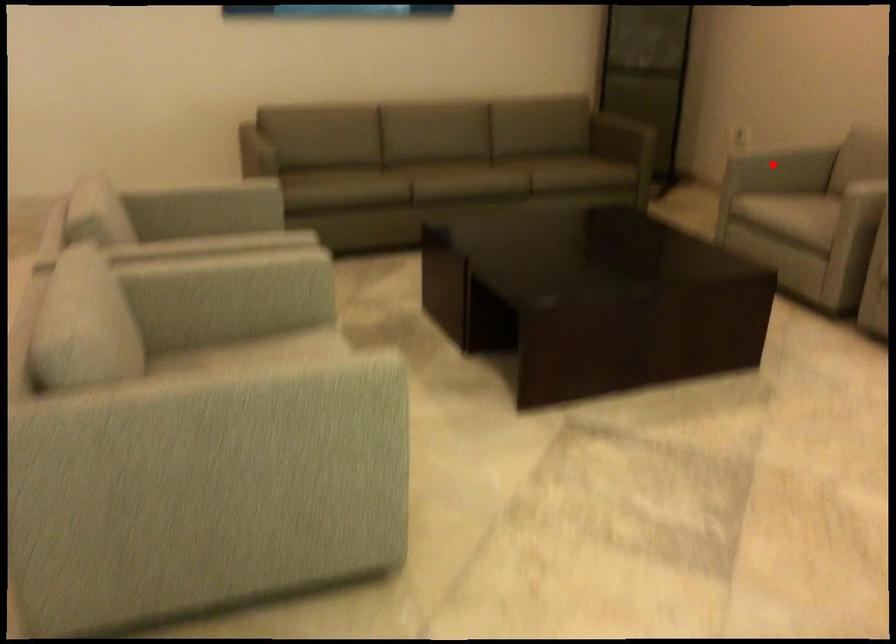
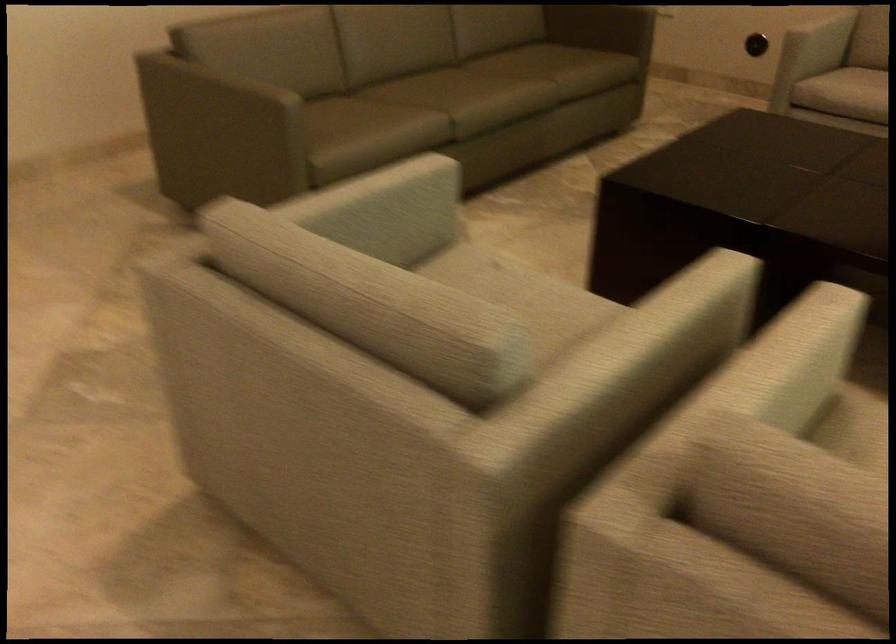
The point at the highlighted location is marked in the first image. Where is the corresponding point in the second image?

(821, 35)